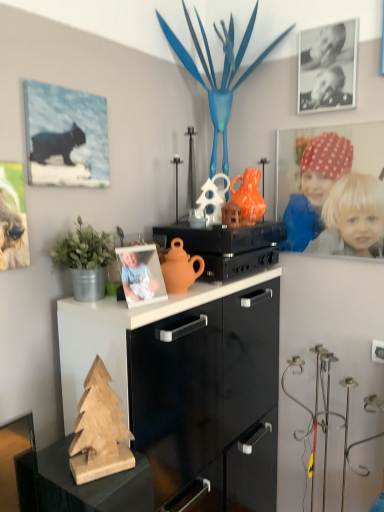
Question: Is wooden christmas tree at lower left wider than matte canvas print of cat at upper left, placed as the 2th picture frame when sorted from right to left?

Choices:
 (A) no
 (B) yes

Answer: (B)

Question: From the image's perspective, is wooden christmas tree at lower left under matte canvas print of cat at upper left, marked as the second picture frame in a back-to-front arrangement?

Choices:
 (A) yes
 (B) no

Answer: (A)

Question: Is wooden christmas tree at lower left directly adjacent to matte canvas print of cat at upper left, marked as the second picture frame in a back-to-front arrangement?

Choices:
 (A) no
 (B) yes

Answer: (A)

Question: Is wooden christmas tree at lower left positioned before matte canvas print of cat at upper left, marked as the second picture frame in a back-to-front arrangement?

Choices:
 (A) no
 (B) yes

Answer: (B)

Question: Could you tell me if wooden christmas tree at lower left is facing matte canvas print of cat at upper left, the 1th picture frame from the left?

Choices:
 (A) yes
 (B) no

Answer: (B)

Question: Is matte canvas print of cat at upper left, the 1th picture frame from the left, bigger or smaller than wooden christmas tree at lower left?

Choices:
 (A) big
 (B) small

Answer: (B)

Question: From their relative heights in the image, would you say matte canvas print of cat at upper left, the second picture frame in the top-to-bottom sequence, is taller or shorter than wooden christmas tree at lower left?

Choices:
 (A) short
 (B) tall

Answer: (B)

Question: Is matte canvas print of cat at upper left, marked as the second picture frame in a back-to-front arrangement, in front of or behind wooden christmas tree at lower left in the image?

Choices:
 (A) behind
 (B) front

Answer: (A)

Question: Considering the positions of point pos(104,186) and point pos(129,437), is point pos(104,186) closer or farther from the camera than point pos(129,437)?

Choices:
 (A) farther
 (B) closer

Answer: (A)

Question: Which is correct: matte black stereo at center is inside black matte photo frame at upper right, the 1th picture frame viewed from the back, or outside of it?

Choices:
 (A) outside
 (B) inside

Answer: (A)

Question: Does point (168, 231) appear closer or farther from the camera than point (345, 70)?

Choices:
 (A) closer
 (B) farther

Answer: (B)

Question: Is matte black stereo at center in front of or behind black matte photo frame at upper right, which is the 1th picture frame in top-to-bottom order, in the image?

Choices:
 (A) behind
 (B) front

Answer: (B)

Question: Is matte black stereo at center to the left or to the right of black matte photo frame at upper right, the 1th picture frame viewed from the back, in the image?

Choices:
 (A) left
 (B) right

Answer: (A)

Question: Would you say green matte plant at left is to the left or to the right of matte black stereo at center in the picture?

Choices:
 (A) left
 (B) right

Answer: (A)

Question: Which is correct: green matte plant at left is inside matte black stereo at center, or outside of it?

Choices:
 (A) outside
 (B) inside

Answer: (A)